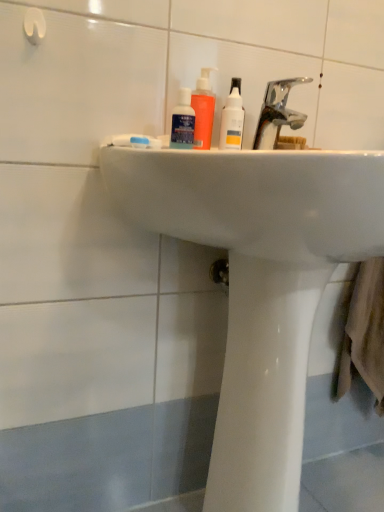
Question: Is white glossy bottle at upper center surrounding blue matte toothpaste at center?

Choices:
 (A) no
 (B) yes

Answer: (A)

Question: Is the position of white glossy bottle at upper center less distant than that of blue matte toothpaste at center?

Choices:
 (A) yes
 (B) no

Answer: (B)

Question: Can you confirm if white glossy bottle at upper center is bigger than blue matte toothpaste at center?

Choices:
 (A) yes
 (B) no

Answer: (A)

Question: Is white glossy bottle at upper center not close to blue matte toothpaste at center?

Choices:
 (A) no
 (B) yes

Answer: (A)

Question: Is white glossy bottle at upper center outside of blue matte toothpaste at center?

Choices:
 (A) no
 (B) yes

Answer: (B)

Question: From the image's perspective, is translucent orange bottle at center, arranged as the first mouthwash when viewed from the back, positioned above or below metallic chrome faucet at upper center?

Choices:
 (A) above
 (B) below

Answer: (A)

Question: Considering the positions of point (x=213, y=103) and point (x=271, y=96), is point (x=213, y=103) closer or farther from the camera than point (x=271, y=96)?

Choices:
 (A) closer
 (B) farther

Answer: (B)

Question: Would you say translucent orange bottle at center, positioned as the second mouthwash in front-to-back order, is inside or outside metallic chrome faucet at upper center?

Choices:
 (A) inside
 (B) outside

Answer: (B)

Question: In the image, is translucent orange bottle at center, arranged as the first mouthwash when viewed from the back, positioned in front of or behind metallic chrome faucet at upper center?

Choices:
 (A) behind
 (B) front

Answer: (A)

Question: Based on their sizes in the image, would you say matte black mouthwash at center, which is the 1th mouthwash in front-to-back order, is bigger or smaller than metallic chrome faucet at upper center?

Choices:
 (A) small
 (B) big

Answer: (A)

Question: Is matte black mouthwash at center, which is the 1th mouthwash in front-to-back order, taller or shorter than metallic chrome faucet at upper center?

Choices:
 (A) tall
 (B) short

Answer: (B)

Question: From a real-world perspective, is matte black mouthwash at center, which is the 1th mouthwash in front-to-back order, positioned above or below metallic chrome faucet at upper center?

Choices:
 (A) above
 (B) below

Answer: (B)

Question: Considering the relative positions of matte black mouthwash at center, which is the 1th mouthwash in front-to-back order, and metallic chrome faucet at upper center in the image provided, is matte black mouthwash at center, which is the 1th mouthwash in front-to-back order, to the left or to the right of metallic chrome faucet at upper center?

Choices:
 (A) left
 (B) right

Answer: (A)

Question: From a real-world perspective, is blue matte toothpaste at center positioned above or below matte black mouthwash at center, which ranks as the second mouthwash in back-to-front order?

Choices:
 (A) above
 (B) below

Answer: (B)

Question: Relative to matte black mouthwash at center, which ranks as the second mouthwash in back-to-front order, is blue matte toothpaste at center in front or behind?

Choices:
 (A) behind
 (B) front

Answer: (B)